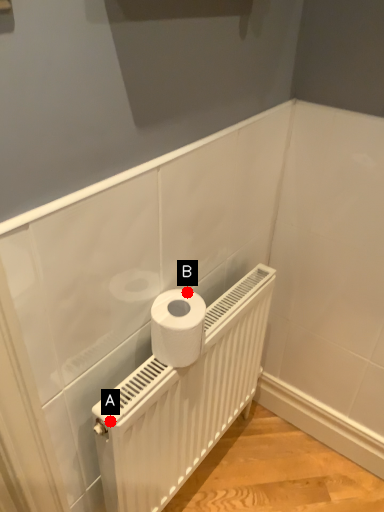
Question: Two points are circled on the image, labeled by A and B beside each circle. Which point is further to the camera?

Choices:
 (A) A is further
 (B) B is further

Answer: (B)